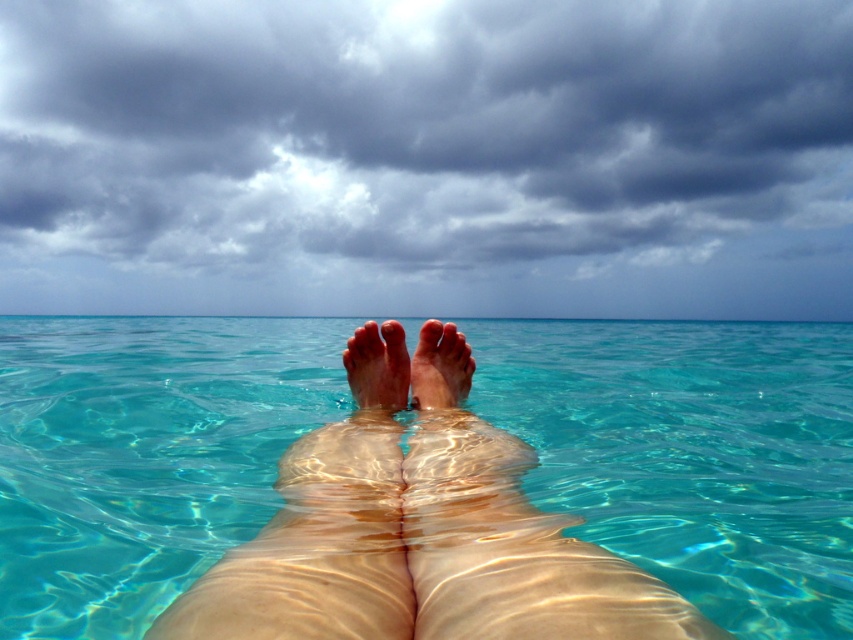
You are a photographer positioned at the camera. You want to capture a closeup shot of the pale skin at center. Given that your camera has a minimum focusing distance of 1.2 meters, will you be able to take the photo without moving closer?

The distance between the pale skin at center and the camera is 1.27 meters, which is just above the minimum focusing distance of 1.2 meters. Therefore, you can take the closeup shot without needing to move closer.